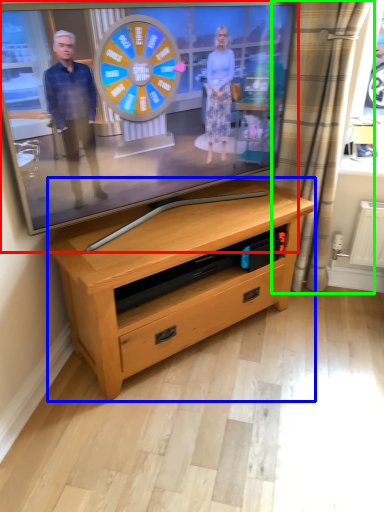
Question: Based on their relative distances, which object is nearer to television (highlighted by a red box)? Choose from chest of drawers (highlighted by a blue box) and curtain (highlighted by a green box).

Choices:
 (A) chest of drawers
 (B) curtain

Answer: (A)